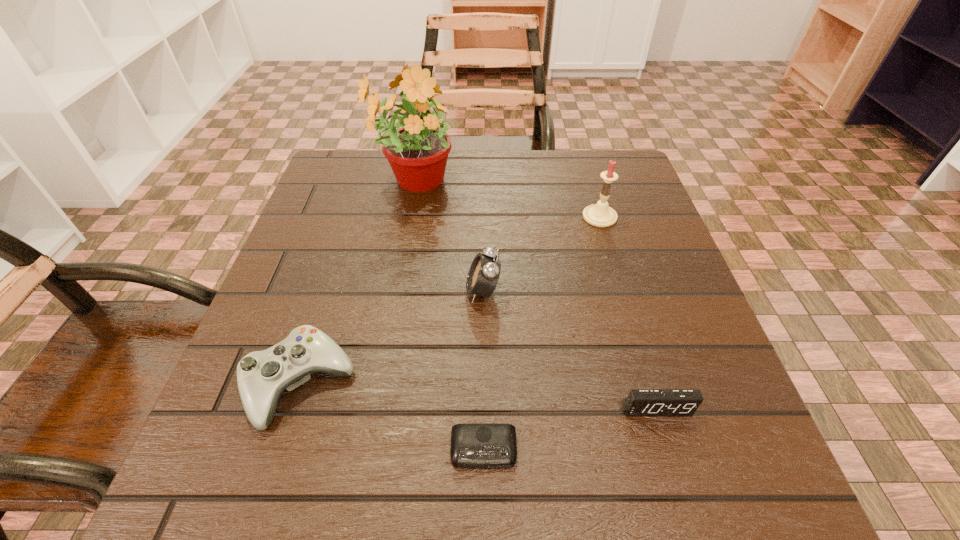
Where is `free area in between the third tallest object and the control`? The width and height of the screenshot is (960, 540). free area in between the third tallest object and the control is located at coordinates (392, 338).

The width and height of the screenshot is (960, 540). Find the location of `free point between the flowerpot and the shortest alarm clock`. free point between the flowerpot and the shortest alarm clock is located at coordinates (448, 315).

The image size is (960, 540). Find the location of `empty space between the nearest alarm clock and the flowerpot`. empty space between the nearest alarm clock and the flowerpot is located at coordinates (448, 315).

This screenshot has width=960, height=540. I want to click on vacant area that lies between the nearest alarm clock and the fifth tallest object, so click(x=570, y=429).

Where is `vacant area that lies between the flowerpot and the candle`? Image resolution: width=960 pixels, height=540 pixels. vacant area that lies between the flowerpot and the candle is located at coordinates [x=506, y=199].

I want to click on free space between the second tallest object and the third tallest object, so click(x=541, y=254).

The height and width of the screenshot is (540, 960). I want to click on empty location between the nearest alarm clock and the second tallest object, so click(x=541, y=333).

Where is `free space between the second shortest object and the second tallest object`? The height and width of the screenshot is (540, 960). free space between the second shortest object and the second tallest object is located at coordinates (628, 313).

Identify the location of unoccupied position between the candle and the fourth tallest object. (450, 300).

Identify the location of free spot between the shortest object and the fifth tallest object. The image size is (960, 540). (570, 429).